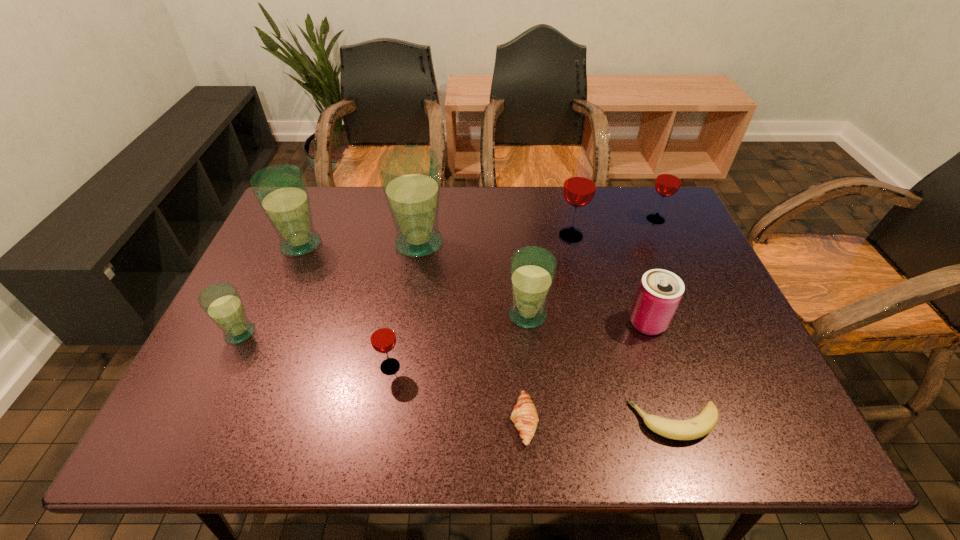
The image size is (960, 540). I want to click on vacant space located on the left of the rightmost blue glass, so click(409, 315).

This screenshot has width=960, height=540. I want to click on vacant space located on the front of the pink can, so click(671, 391).

Where is `free spot located on the front of the nearest glass`? free spot located on the front of the nearest glass is located at coordinates (376, 449).

I want to click on vacant area located on the back of the smallest blue glass, so click(275, 261).

Identify the location of vacant area situated 0.340m on the front-facing side of the pastry. (341, 421).

Find the location of a particular element. free region located 0.130m on the front-facing side of the pastry is located at coordinates (445, 421).

What are the coordinates of `vacant region located 0.320m on the front-facing side of the pastry` in the screenshot? It's located at (351, 421).

I want to click on free space located at the stem of the banana, so click(483, 421).

At what (x,y) coordinates should I click in order to perform the action: click on free space located 0.140m at the stem of the banana. Please return your answer as a coordinate pair (x, y). Looking at the image, I should click on (563, 421).

At what (x,y) coordinates should I click in order to perform the action: click on vacant position located at the stem of the banana. Please return your answer as a coordinate pair (x, y). Looking at the image, I should click on (542, 421).